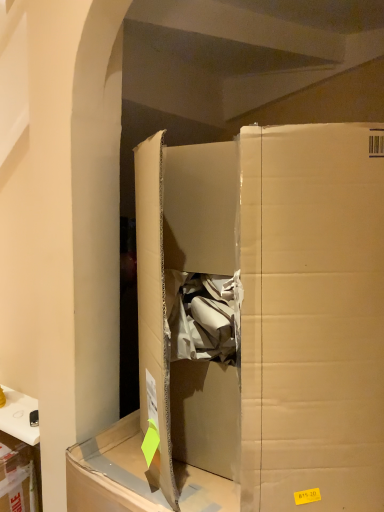
Locate an element on the screen. The width and height of the screenshot is (384, 512). cardboard box at center is located at coordinates (273, 309).

The image size is (384, 512). Describe the element at coordinates (273, 309) in the screenshot. I see `cardboard box at center` at that location.

Find the location of `cardboard box at center`. cardboard box at center is located at coordinates (273, 309).